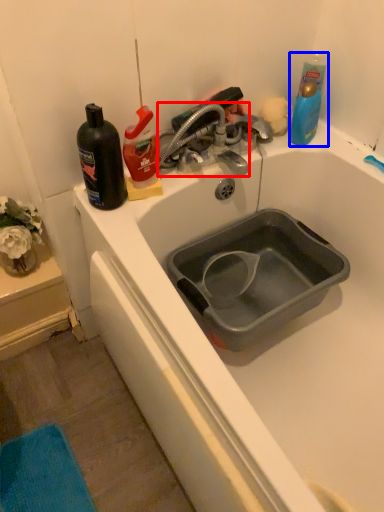
Question: Which object is closer to the camera taking this photo, tap (highlighted by a red box) or cleaning product (highlighted by a blue box)?

Choices:
 (A) tap
 (B) cleaning product

Answer: (A)